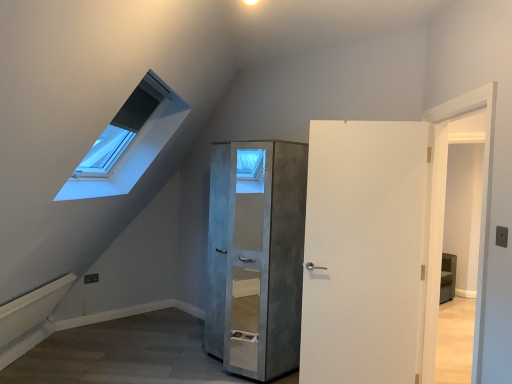
Question: Is concrete textured cabinet at center not near white matte door at center?

Choices:
 (A) yes
 (B) no

Answer: (B)

Question: Would you say concrete textured cabinet at center is outside white matte door at center?

Choices:
 (A) no
 (B) yes

Answer: (B)

Question: From a real-world perspective, is concrete textured cabinet at center over white matte door at center?

Choices:
 (A) no
 (B) yes

Answer: (A)

Question: Is concrete textured cabinet at center at the left side of white matte door at center?

Choices:
 (A) no
 (B) yes

Answer: (B)

Question: Does concrete textured cabinet at center come behind white matte door at center?

Choices:
 (A) yes
 (B) no

Answer: (A)

Question: Could you tell me if concrete textured cabinet at center is turned towards white matte door at center?

Choices:
 (A) yes
 (B) no

Answer: (B)

Question: Is white matte door at center positioned with its back to concrete textured cabinet at center?

Choices:
 (A) no
 (B) yes

Answer: (A)

Question: Is white matte door at center bigger than concrete textured cabinet at center?

Choices:
 (A) no
 (B) yes

Answer: (A)

Question: Is white matte door at center with concrete textured cabinet at center?

Choices:
 (A) yes
 (B) no

Answer: (B)

Question: From a real-world perspective, is white matte door at center beneath concrete textured cabinet at center?

Choices:
 (A) no
 (B) yes

Answer: (A)

Question: From a real-world perspective, is white matte door at center over concrete textured cabinet at center?

Choices:
 (A) no
 (B) yes

Answer: (B)

Question: Can you confirm if white matte door at center is positioned to the right of concrete textured cabinet at center?

Choices:
 (A) yes
 (B) no

Answer: (A)

Question: Considering the positions of point (337, 147) and point (239, 160), is point (337, 147) closer or farther from the camera than point (239, 160)?

Choices:
 (A) closer
 (B) farther

Answer: (A)